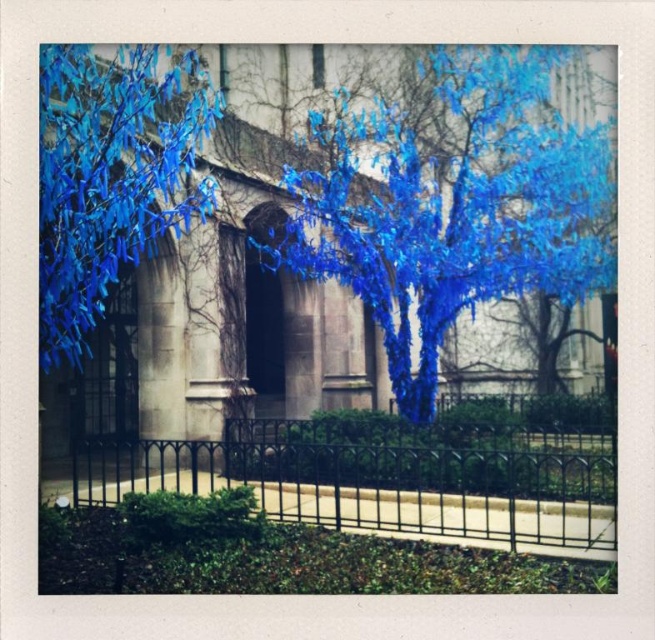
Question: Does black wrought iron fence at center come in front of blue glossy leaves at upper left?

Choices:
 (A) no
 (B) yes

Answer: (A)

Question: Among these objects, which one is farthest from the camera?

Choices:
 (A) blue glossy tree at center
 (B) black wrought iron fence at center

Answer: (A)

Question: From the image, what is the correct spatial relationship of blue glossy tree at center in relation to blue glossy leaves at upper left?

Choices:
 (A) above
 (B) below

Answer: (A)

Question: Which object appears farthest from the camera in this image?

Choices:
 (A) black wrought iron fence at center
 (B) blue glossy tree at center
 (C) blue glossy leaves at upper left

Answer: (B)

Question: Does blue glossy tree at center have a greater width compared to black wrought iron fence at center?

Choices:
 (A) no
 (B) yes

Answer: (B)

Question: Which point appears farthest from the camera in this image?

Choices:
 (A) (140, 474)
 (B) (379, 186)

Answer: (B)